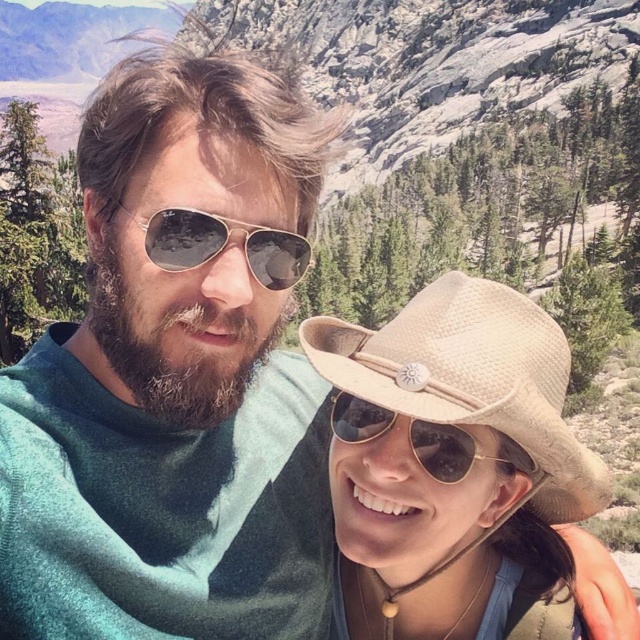
Question: Does beige straw cowboy hat at center come in front of gold reflective aviator sunglasses at center?

Choices:
 (A) yes
 (B) no

Answer: (A)

Question: Which of the following is the closest to the observer?

Choices:
 (A) gold reflective aviator sunglasses at center
 (B) beige straw cowboy hat at center

Answer: (B)

Question: Based on their relative distances, which object is farther from the gold reflective aviator sunglasses at center?

Choices:
 (A) beige straw cowboy hat at center
 (B) sunglasses at center

Answer: (B)

Question: Is gold reflective aviator sunglasses at center positioned in front of sunglasses at center?

Choices:
 (A) no
 (B) yes

Answer: (B)

Question: Can you confirm if gold reflective aviator sunglasses at center is thinner than sunglasses at center?

Choices:
 (A) yes
 (B) no

Answer: (A)

Question: Which point is farther from the camera taking this photo?

Choices:
 (A) (189, 237)
 (B) (353, 412)
 (C) (378, 392)

Answer: (B)